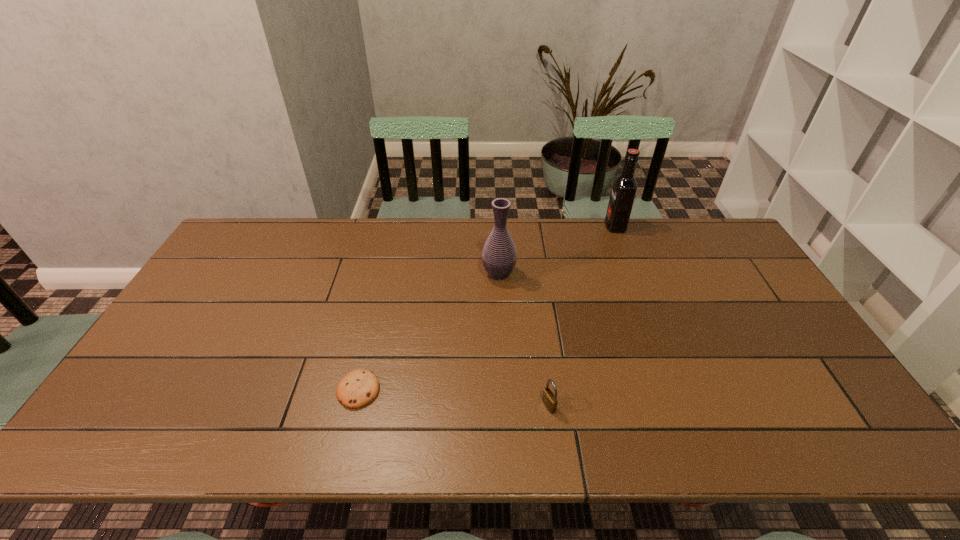
Image resolution: width=960 pixels, height=540 pixels. What are the coordinates of `free spot between the farthest object and the third object from right to left` in the screenshot? It's located at (557, 250).

Where is `free space that is in between the third tallest object and the shortest object`? The image size is (960, 540). free space that is in between the third tallest object and the shortest object is located at coordinates [x=453, y=397].

At what (x,y) coordinates should I click in order to perform the action: click on object that is the third closest to the second shortest object. Please return your answer as a coordinate pair (x, y). Looking at the image, I should click on (624, 187).

Select which object appears as the closest to the second object from left to right. Please provide its 2D coordinates. Your answer should be formatted as a tuple, i.e. [(x, y)], where the tuple contains the x and y coordinates of a point satisfying the conditions above.

[(624, 187)]